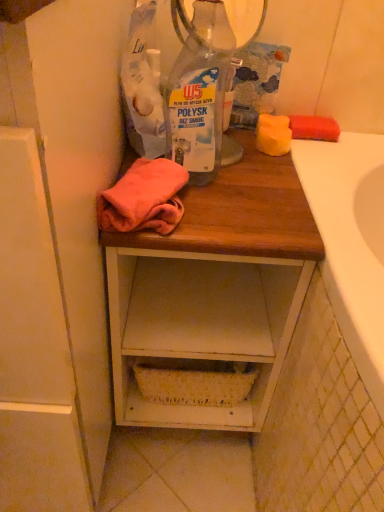
This screenshot has height=512, width=384. Find the location of `vacant space to the right of transparent plastic bottle at center`. vacant space to the right of transparent plastic bottle at center is located at coordinates (273, 173).